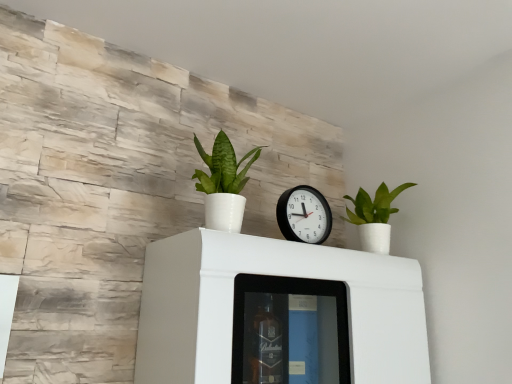
Where is `green matte plant at upper right, which is the 2th houseplant from front to back`? The width and height of the screenshot is (512, 384). green matte plant at upper right, which is the 2th houseplant from front to back is located at coordinates (374, 216).

The width and height of the screenshot is (512, 384). Describe the element at coordinates (223, 183) in the screenshot. I see `green glossy plant at center, the first houseplant viewed from the front` at that location.

Identify the location of black plastic wall clock at center. (304, 215).

Which object is wider, green glossy plant at center, the first houseplant viewed from the front, or green matte plant at upper right, which is the 2th houseplant from front to back?

green glossy plant at center, the first houseplant viewed from the front.

Is green glossy plant at center, acting as the 2th houseplant starting from the right, situated inside green matte plant at upper right, which is counted as the second houseplant, starting from the left, or outside?

green glossy plant at center, acting as the 2th houseplant starting from the right, cannot be found inside green matte plant at upper right, which is counted as the second houseplant, starting from the left.

Is green glossy plant at center, acting as the 1th houseplant starting from the left, behind green matte plant at upper right, which is the 2th houseplant from front to back?

No, the depth of green glossy plant at center, acting as the 1th houseplant starting from the left, is less than that of green matte plant at upper right, which is the 2th houseplant from front to back.

From the image's perspective, which one is positioned lower, green glossy plant at center, acting as the 2th houseplant starting from the right, or green matte plant at upper right, which is the first houseplant in right-to-left order?

green matte plant at upper right, which is the first houseplant in right-to-left order, is shown below in the image.

From the image's perspective, is white glossy cabinet at center below green matte plant at upper right, which is counted as the second houseplant, starting from the left?

Indeed, from the image's perspective, white glossy cabinet at center is shown beneath green matte plant at upper right, which is counted as the second houseplant, starting from the left.

Based on their positions, is white glossy cabinet at center located to the left or right of green matte plant at upper right, which is counted as the second houseplant, starting from the left?

Based on their positions, white glossy cabinet at center is located to the left of green matte plant at upper right, which is counted as the second houseplant, starting from the left.

Considering the relative positions of white glossy cabinet at center and green matte plant at upper right, which is the 2th houseplant from front to back, in the image provided, is white glossy cabinet at center in front of green matte plant at upper right, which is the 2th houseplant from front to back,?

Yes, white glossy cabinet at center is closer to the viewer.

I want to click on houseplant on the right of white glossy cabinet at center, so click(374, 216).

Looking at this image, would you consider green matte plant at upper right, which is the first houseplant in right-to-left order, to be distant from white glossy cabinet at center?

green matte plant at upper right, which is the first houseplant in right-to-left order, is near white glossy cabinet at center, not far away.

Is green matte plant at upper right, which is the first houseplant in right-to-left order, looking in the opposite direction of white glossy cabinet at center?

No, green matte plant at upper right, which is the first houseplant in right-to-left order, is not facing the opposite direction of white glossy cabinet at center.

From the image's perspective, which object appears higher, green matte plant at upper right, which is counted as the second houseplant, starting from the left, or white glossy cabinet at center?

green matte plant at upper right, which is counted as the second houseplant, starting from the left, is shown above in the image.

Consider the image. Relative to white glossy cabinet at center, is black plastic wall clock at center in front or behind?

In the image, black plastic wall clock at center appears behind white glossy cabinet at center.

Between point (310, 195) and point (276, 329), which one is positioned in front?

The point (276, 329) is in front.

Based on the photo, is black plastic wall clock at center completely or partially outside of white glossy cabinet at center?

Absolutely, black plastic wall clock at center is external to white glossy cabinet at center.

Considering the sizes of objects black plastic wall clock at center and white glossy cabinet at center in the image provided, who is shorter, black plastic wall clock at center or white glossy cabinet at center?

black plastic wall clock at center is shorter.

Considering the sizes of white glossy cabinet at center and black plastic wall clock at center in the image, is white glossy cabinet at center bigger or smaller than black plastic wall clock at center?

In the image, white glossy cabinet at center appears to be larger than black plastic wall clock at center.

From a real-world perspective, is white glossy cabinet at center beneath black plastic wall clock at center?

Yes, from a real-world perspective, white glossy cabinet at center is under black plastic wall clock at center.

From the image's perspective, is white glossy cabinet at center positioned above or below black plastic wall clock at center?

Clearly, from the image's perspective, white glossy cabinet at center is below black plastic wall clock at center.

Considering the relative sizes of white glossy cabinet at center and black plastic wall clock at center in the image provided, is white glossy cabinet at center wider than black plastic wall clock at center?

Yes, white glossy cabinet at center is wider than black plastic wall clock at center.

Which is closer, [284,298] or [224,224]?

The point [224,224] is in front.

Can you tell me how much white glossy cabinet at center and green glossy plant at center, acting as the 2th houseplant starting from the right, differ in facing direction?

They differ by 0.000445 degrees in their facing directions.

Does white glossy cabinet at center have a larger size compared to green glossy plant at center, the first houseplant viewed from the front?

Indeed, white glossy cabinet at center has a larger size compared to green glossy plant at center, the first houseplant viewed from the front.

Based on the photo, is white glossy cabinet at center beside green glossy plant at center, acting as the 1th houseplant starting from the left?

No, white glossy cabinet at center is not next to green glossy plant at center, acting as the 1th houseplant starting from the left.

From the image's perspective, which is below, black plastic wall clock at center or green matte plant at upper right, which is counted as the second houseplant, starting from the left?

green matte plant at upper right, which is counted as the second houseplant, starting from the left, is shown below in the image.

Is black plastic wall clock at center facing away from green matte plant at upper right, which is counted as the second houseplant, starting from the left?

That's not correct — black plastic wall clock at center is not looking away from green matte plant at upper right, which is counted as the second houseplant, starting from the left.

Which point is more forward, (x=310, y=238) or (x=388, y=229)?

Positioned in front is point (x=310, y=238).

Is black plastic wall clock at center far from green matte plant at upper right, the first houseplant from the back?

black plastic wall clock at center is near green matte plant at upper right, the first houseplant from the back, not far away.

In order to click on houseplant below the green glossy plant at center, acting as the 2th houseplant starting from the right (from the image's perspective) in this screenshot , I will do `click(374, 216)`.

Starting from the white glossy cabinet at center, which houseplant is the 2nd one behind? Please provide its 2D coordinates.

[(374, 216)]

Based on their spatial positions, is green glossy plant at center, the first houseplant viewed from the front, or green matte plant at upper right, which is the 2th houseplant from front to back, further from white glossy cabinet at center?

green matte plant at upper right, which is the 2th houseplant from front to back.

Considering their positions, is white glossy cabinet at center positioned further to green glossy plant at center, the second houseplant in the back-to-front sequence, than green matte plant at upper right, the first houseplant from the back?

green matte plant at upper right, the first houseplant from the back.

Considering their positions, is black plastic wall clock at center positioned further to green matte plant at upper right, which is the first houseplant in right-to-left order, than green glossy plant at center, acting as the 2th houseplant starting from the right?

Among the two, green glossy plant at center, acting as the 2th houseplant starting from the right, is located further to green matte plant at upper right, which is the first houseplant in right-to-left order.

From the image, which object appears to be nearer to green glossy plant at center, acting as the 1th houseplant starting from the left, green matte plant at upper right, which is counted as the second houseplant, starting from the left, or black plastic wall clock at center?

black plastic wall clock at center.

Considering their positions, is green matte plant at upper right, which is the first houseplant in right-to-left order, positioned closer to white glossy cabinet at center than black plastic wall clock at center?

black plastic wall clock at center.

Considering their positions, is white glossy cabinet at center positioned further to green matte plant at upper right, the first houseplant from the back, than green glossy plant at center, acting as the 2th houseplant starting from the right?

green glossy plant at center, acting as the 2th houseplant starting from the right, is positioned further to the anchor green matte plant at upper right, the first houseplant from the back.

Which object lies nearer to the anchor point white glossy cabinet at center, black plastic wall clock at center or green matte plant at upper right, which is counted as the second houseplant, starting from the left?

Based on the image, black plastic wall clock at center appears to be nearer to white glossy cabinet at center.

Based on their spatial positions, is white glossy cabinet at center or black plastic wall clock at center further from green glossy plant at center, acting as the 1th houseplant starting from the left?

white glossy cabinet at center is further to green glossy plant at center, acting as the 1th houseplant starting from the left.

Image resolution: width=512 pixels, height=384 pixels. What are the coordinates of `furniture between green glossy plant at center, acting as the 2th houseplant starting from the right, and green matte plant at upper right, the first houseplant from the back, in the horizontal direction` in the screenshot? It's located at (278, 313).

Identify the location of wall clock located between white glossy cabinet at center and green matte plant at upper right, the first houseplant from the back, in the depth direction. The image size is (512, 384). (304, 215).

Find the location of a particular element. The width and height of the screenshot is (512, 384). wall clock between green glossy plant at center, acting as the 1th houseplant starting from the left, and white glossy cabinet at center vertically is located at coordinates (304, 215).

Find the location of a particular element. The height and width of the screenshot is (384, 512). wall clock located between green glossy plant at center, acting as the 1th houseplant starting from the left, and green matte plant at upper right, which is the 2th houseplant from front to back, in the left-right direction is located at coordinates (x=304, y=215).